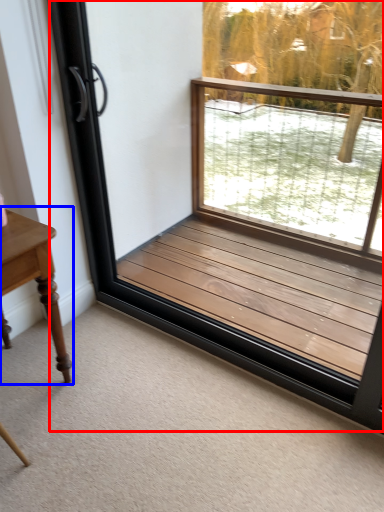
Question: Which of the following is the farthest to the observer, window frame (highlighted by a red box) or table (highlighted by a blue box)?

Choices:
 (A) window frame
 (B) table

Answer: (B)